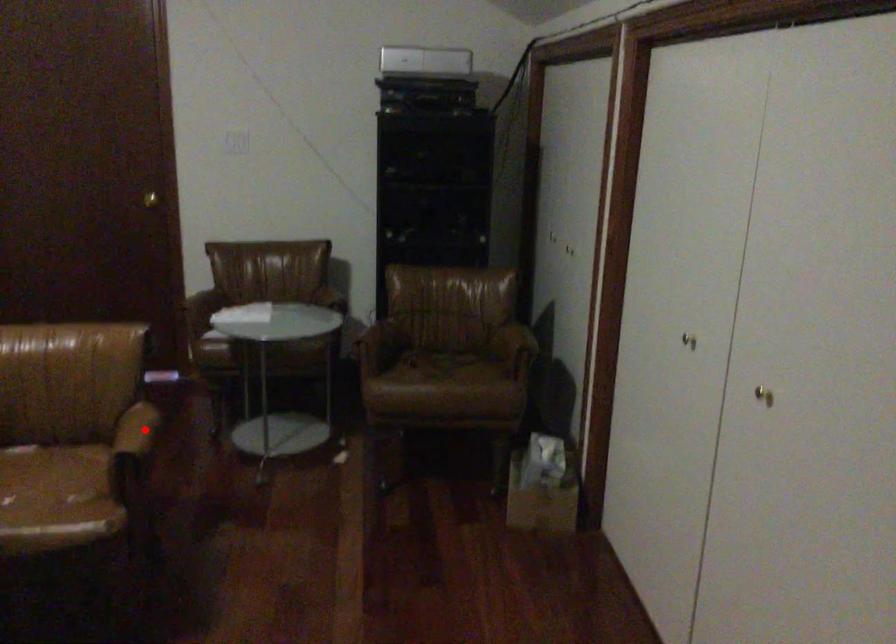
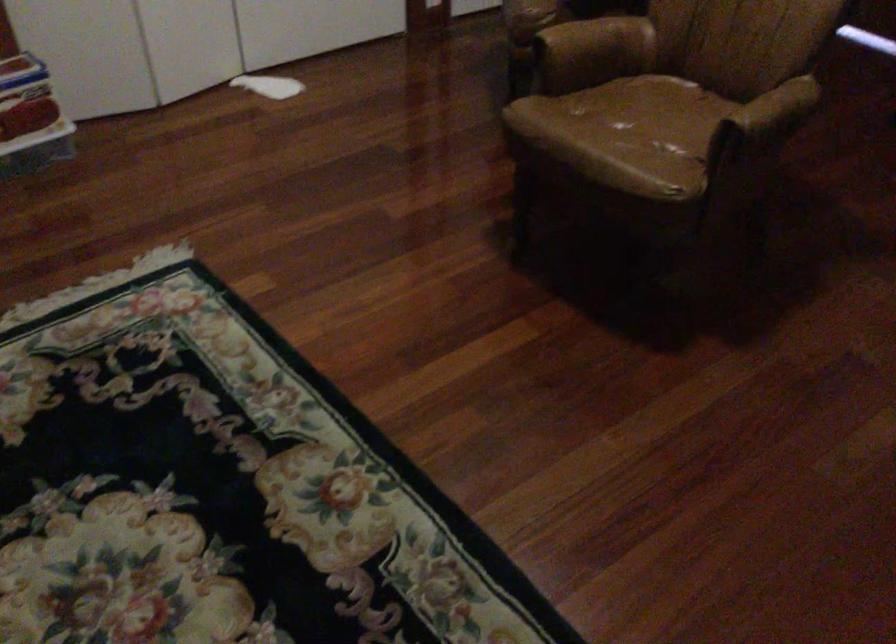
Where in the second image is the point corresponding to the highlighted location from the first image?

(776, 109)